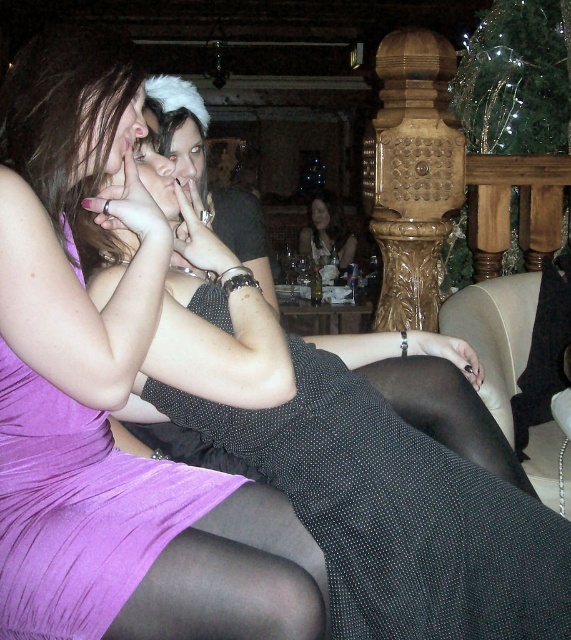
Question: Estimate the real-world distances between objects in this image. Which object is closer to the matte black dress at center?

Choices:
 (A) black textured dress at center
 (B) purple pleated dress at center

Answer: (A)

Question: Is black textured dress at center further to the viewer compared to matte black dress at center?

Choices:
 (A) no
 (B) yes

Answer: (A)

Question: Considering the relative positions of purple pleated dress at center and matte black dress at center in the image provided, where is purple pleated dress at center located with respect to matte black dress at center?

Choices:
 (A) below
 (B) above

Answer: (A)

Question: Which point is closer to the camera?

Choices:
 (A) purple pleated dress at center
 (B) matte black dress at center

Answer: (A)

Question: Which point is farther to the camera?

Choices:
 (A) (379, 540)
 (B) (307, 252)

Answer: (B)

Question: Can you confirm if purple pleated dress at center is positioned to the right of matte black dress at center?

Choices:
 (A) yes
 (B) no

Answer: (B)